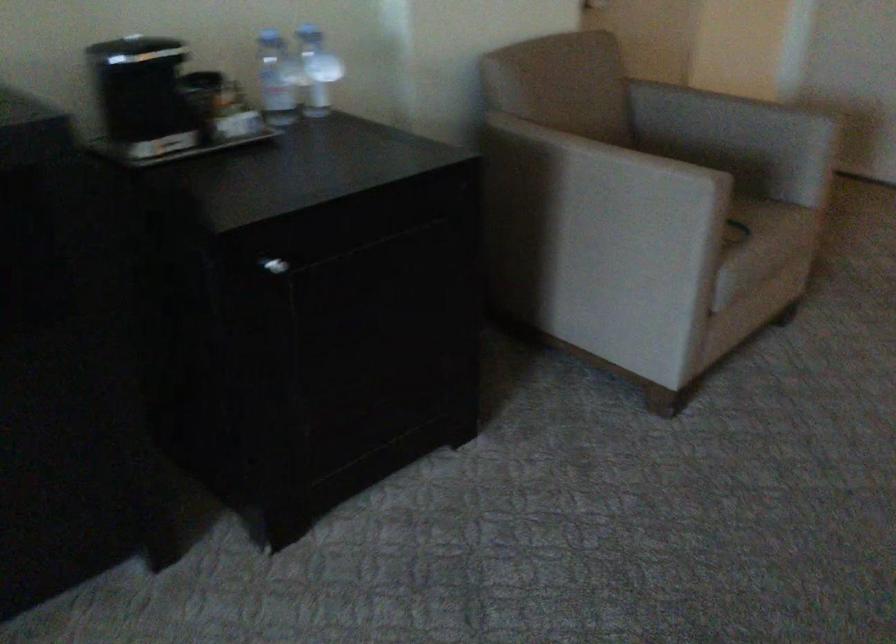
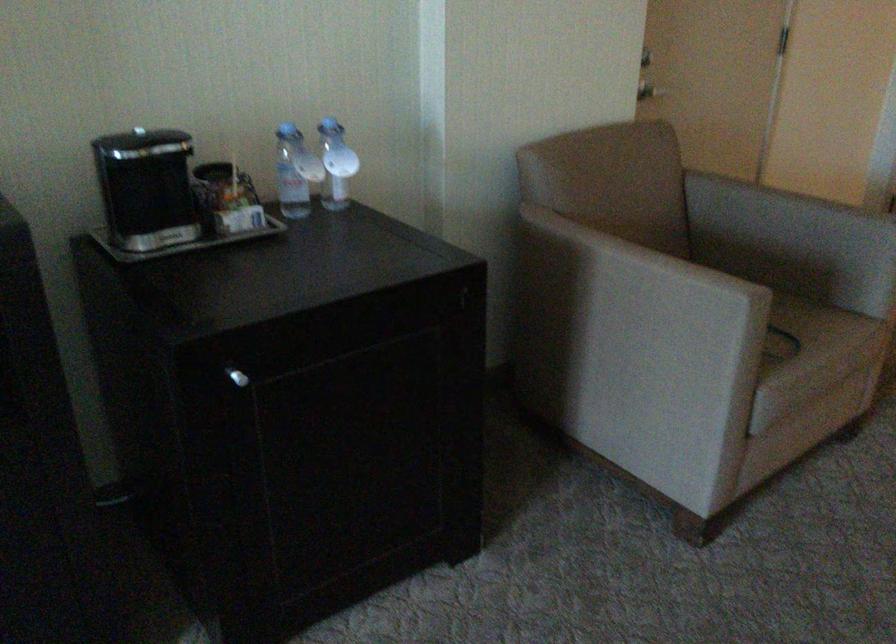
Locate, in the second image, the point that corresponds to (149,102) in the first image.

(149, 194)